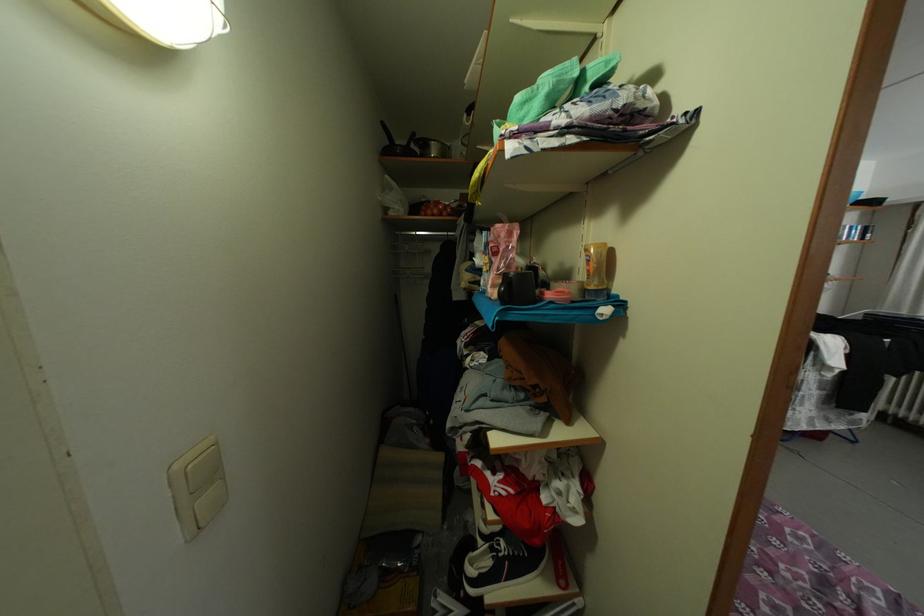
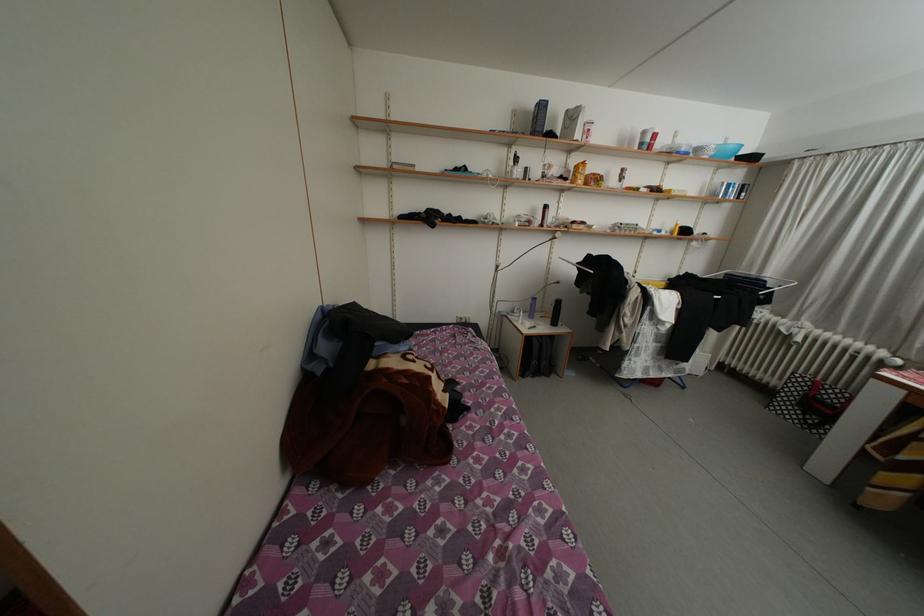
Question: Based on the continuous images, in which direction is the camera rotating? Reply with the corresponding letter.

Choices:
 (A) Left
 (B) Right
 (C) Up
 (D) Down

Answer: (D)